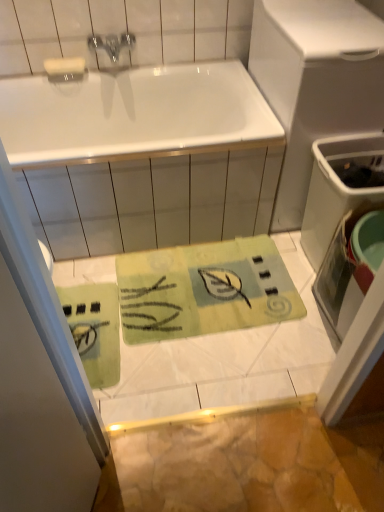
Question: Looking at the image, does white plastic trash can at right seem bigger or smaller compared to green fabric mat at upper center?

Choices:
 (A) small
 (B) big

Answer: (B)

Question: Considering the positions of point (362, 130) and point (97, 446), is point (362, 130) closer or farther from the camera than point (97, 446)?

Choices:
 (A) closer
 (B) farther

Answer: (B)

Question: Estimate the real-world distances between objects in this image. Which object is closer to the green fabric mat at upper center?

Choices:
 (A) white matte bar of soap at upper left
 (B) white plastic trash can at right
 (C) white glossy bathtub at upper center
 (D) metallic faucet at upper center

Answer: (C)

Question: Estimate the real-world distances between objects in this image. Which object is closer to the white glossy bathtub at upper center?

Choices:
 (A) white plastic trash can at right
 (B) white matte bar of soap at upper left
 (C) metallic faucet at upper center
 (D) green fabric mat at upper center

Answer: (A)